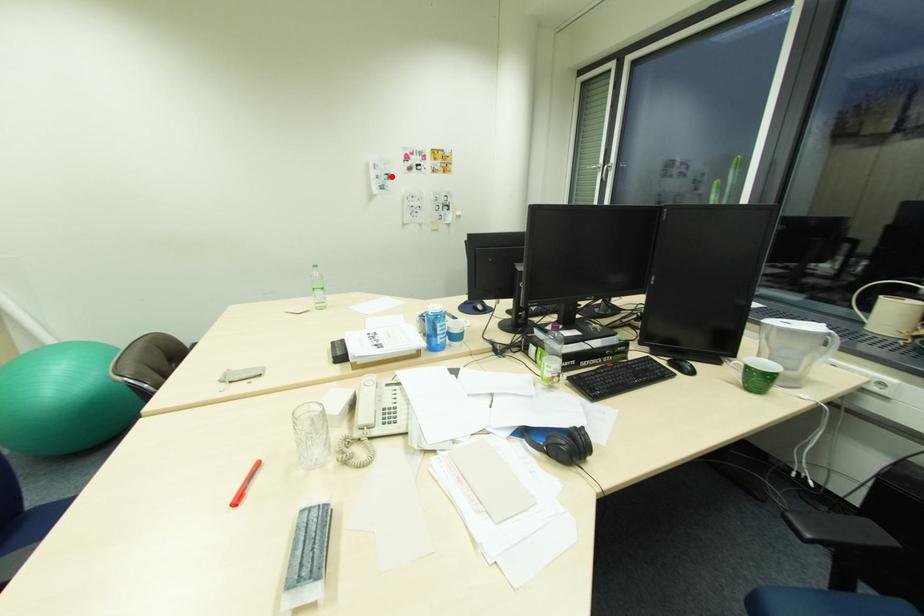
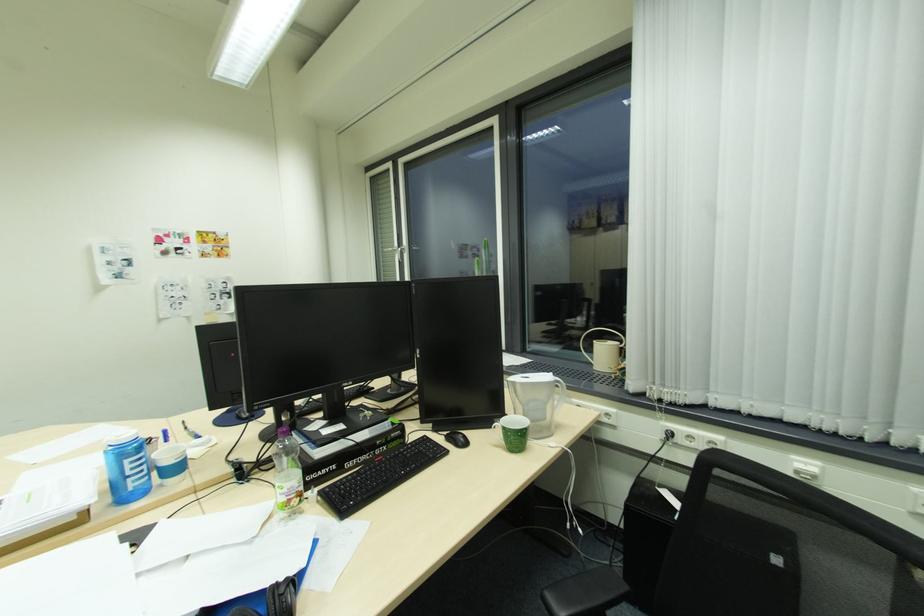
Question: A red point is marked in image1. In image2, is the corresponding 3D point closer to the camera or farther? Reply with the corresponding letter.

Choices:
 (A) The corresponding 3D point is closer.
 (B) The corresponding 3D point is farther.

Answer: (B)